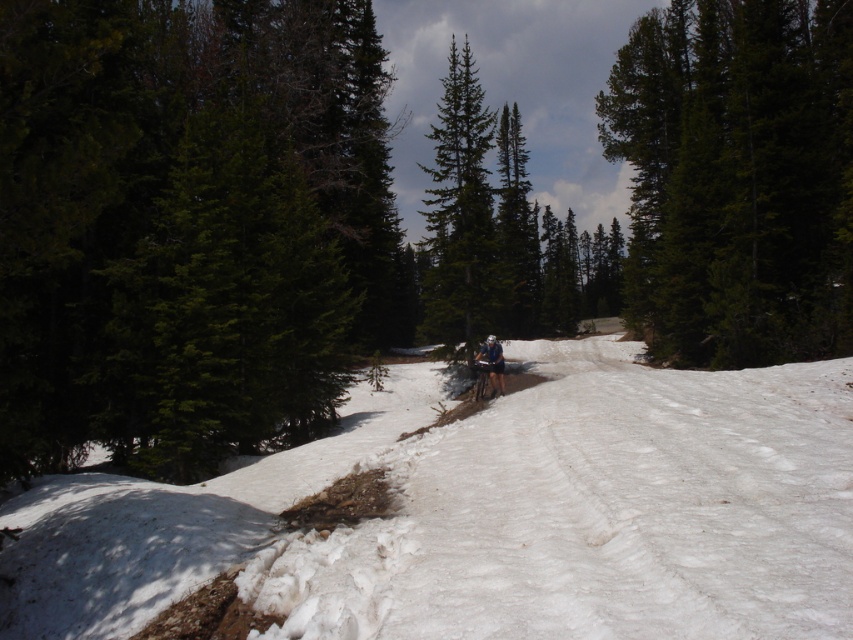
Is white powdery snow at center to the right of green matte tree at upper right from the viewer's perspective?

Incorrect, white powdery snow at center is not on the right side of green matte tree at upper right.

Can you confirm if white powdery snow at center is shorter than green matte tree at upper right?

Correct, white powdery snow at center is not as tall as green matte tree at upper right.

Measure the distance between point (428, 625) and camera.

A distance of 4.61 meters exists between point (428, 625) and camera.

Image resolution: width=853 pixels, height=640 pixels. In order to click on white powdery snow at center in this screenshot , I will do (492, 515).

Can you confirm if green textured pine tree at center is thinner than white helmet at center?

Incorrect, green textured pine tree at center's width is not less than white helmet at center's.

Is point (467, 77) closer to viewer compared to point (497, 365)?

That is False.

Identify the location of green textured pine tree at center. (459, 212).

Which is above, white powdery snow at center or white helmet at center?

Positioned higher is white helmet at center.

This screenshot has height=640, width=853. Find the location of `white powdery snow at center`. white powdery snow at center is located at coordinates (492, 515).

Is point (329, 436) positioned after point (479, 356)?

That is False.

You are a GUI agent. You are given a task and a screenshot of the screen. Output one action in this format:
    pyautogui.click(x=<x>, y=<y>)
    Task: Click on the white powdery snow at center
    This screenshot has height=640, width=853.
    Given the screenshot: What is the action you would take?
    pyautogui.click(x=492, y=515)